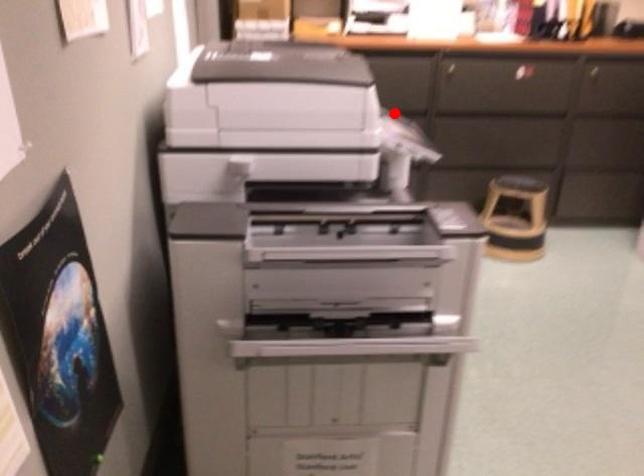
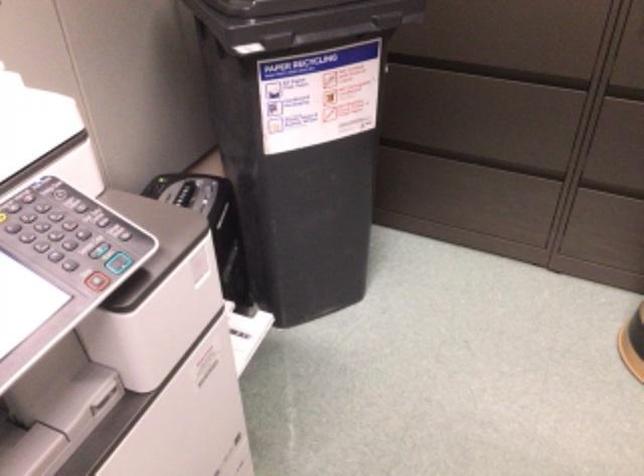
Question: I am providing you with two images of the same scene from different viewpoints. Image1 has a red point marked. In image2, the corresponding 3D location appears at what relative position? Reply with the corresponding letter.

Choices:
 (A) Closer
 (B) Farther

Answer: (A)